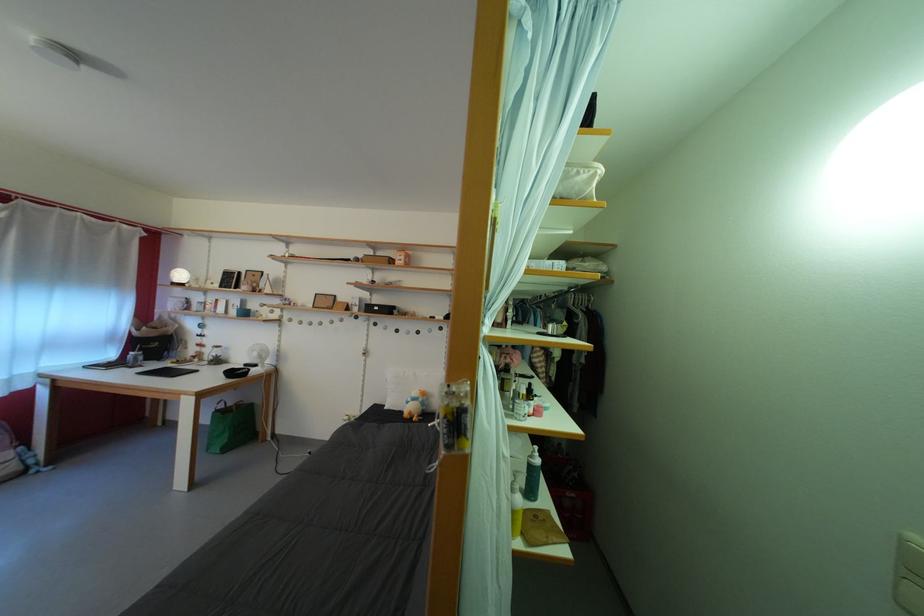
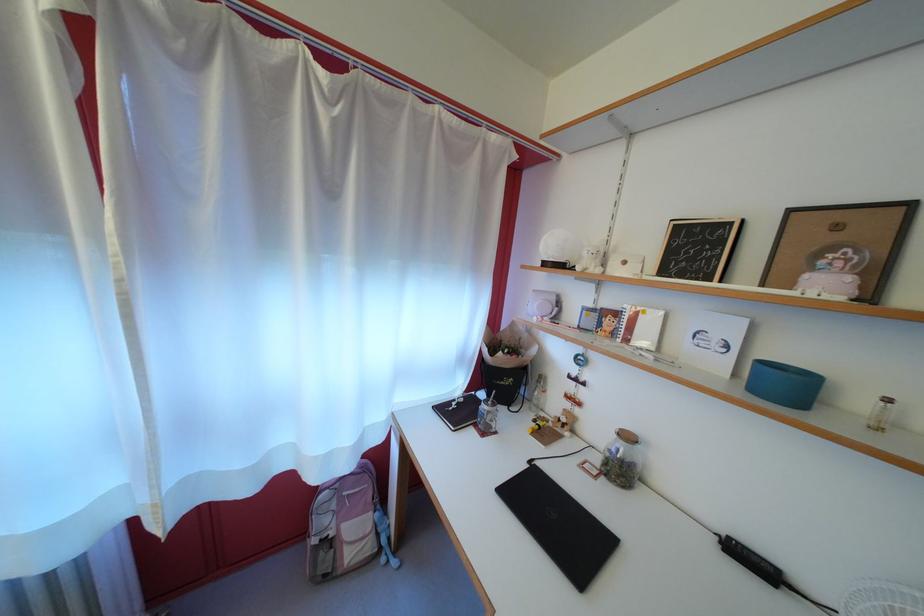
Find the pixel in the second image that matches pixel 226 353 in the first image.

(637, 444)